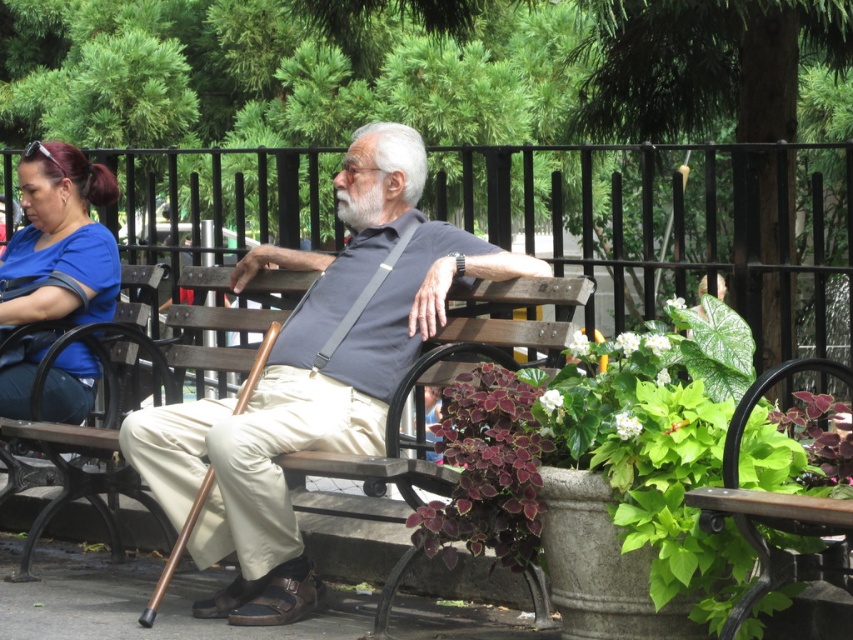
Which of these two, matte brown cane at center or brown wood bench at left, stands shorter?

Standing shorter between the two is brown wood bench at left.

Does matte brown cane at center have a greater width compared to brown wood bench at left?

Yes, matte brown cane at center is wider than brown wood bench at left.

You are a GUI agent. You are given a task and a screenshot of the screen. Output one action in this format:
    pyautogui.click(x=<x>, y=<y>)
    Task: Click on the matte brown cane at center
    The width and height of the screenshot is (853, 640).
    Given the screenshot: What is the action you would take?
    pyautogui.click(x=312, y=378)

Is matte brown cane at center below purple leafy plant at lower center?

Actually, matte brown cane at center is above purple leafy plant at lower center.

Between matte brown cane at center and purple leafy plant at lower center, which one appears on the right side from the viewer's perspective?

purple leafy plant at lower center is more to the right.

Who is more distant from viewer, (138,442) or (503,380)?

Positioned behind is point (138,442).

This screenshot has height=640, width=853. In order to click on matte brown cane at center in this screenshot , I will do `click(312, 378)`.

From the picture: Is matte brown cane at center bigger than green leafy plant at lower right?

Correct, matte brown cane at center is larger in size than green leafy plant at lower right.

Which is in front, point (198, 520) or point (613, 488)?

Point (613, 488) is in front.

Where is `matte brown cane at center`? matte brown cane at center is located at coordinates (312, 378).